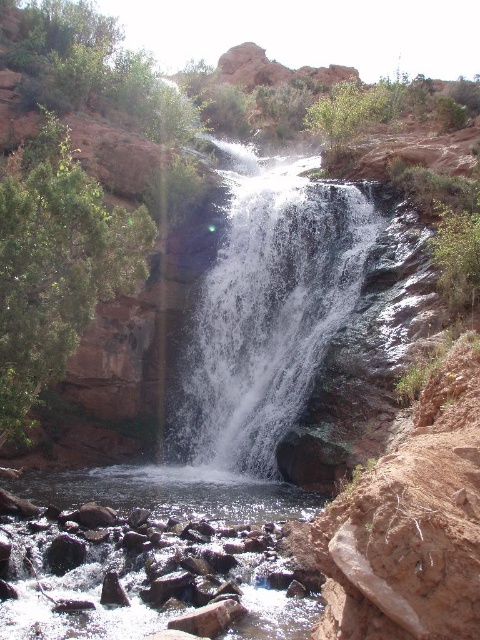
Question: Is white frothy water at center smaller than clear water at center?

Choices:
 (A) no
 (B) yes

Answer: (A)

Question: Can you confirm if white frothy water at center is bigger than clear water at center?

Choices:
 (A) yes
 (B) no

Answer: (A)

Question: Which object appears closest to the camera in this image?

Choices:
 (A) white frothy water at center
 (B) clear water at center

Answer: (B)

Question: Can you confirm if white frothy water at center is smaller than clear water at center?

Choices:
 (A) yes
 (B) no

Answer: (B)